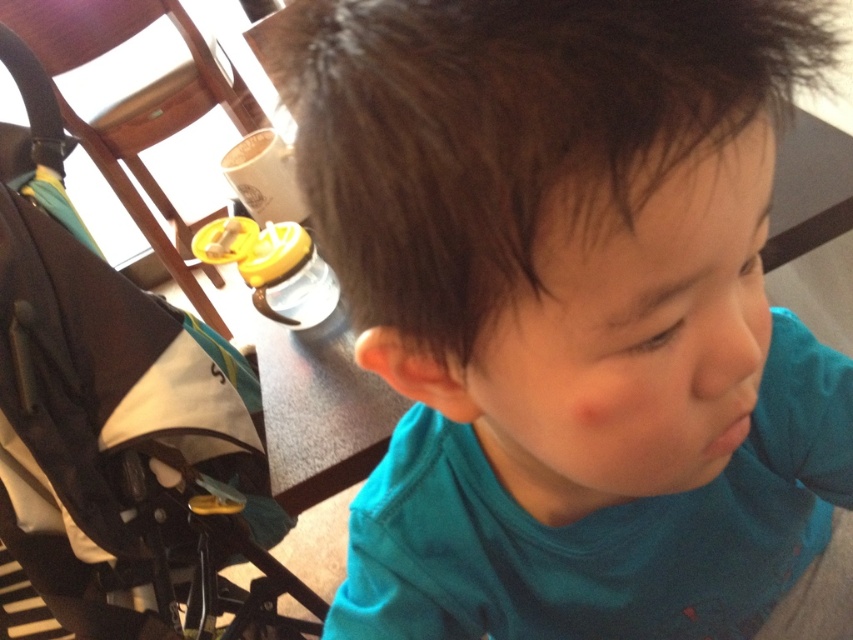
Which of these two, teal matte shirt at center or black fabric stroller at left, stands taller?

black fabric stroller at left

Can you confirm if teal matte shirt at center is taller than black fabric stroller at left?

No, teal matte shirt at center is not taller than black fabric stroller at left.

This screenshot has height=640, width=853. Find the location of `teal matte shirt at center`. teal matte shirt at center is located at coordinates (573, 316).